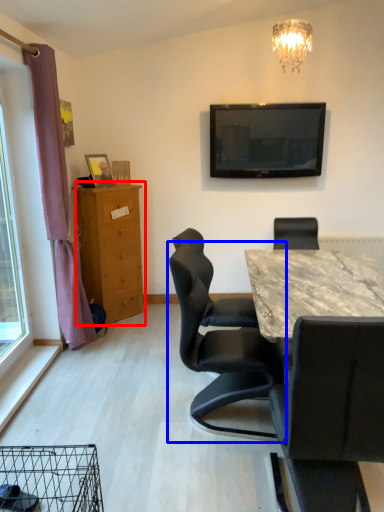
Question: Which object is further to the camera taking this photo, chest of drawers (highlighted by a red box) or chair (highlighted by a blue box)?

Choices:
 (A) chest of drawers
 (B) chair

Answer: (A)